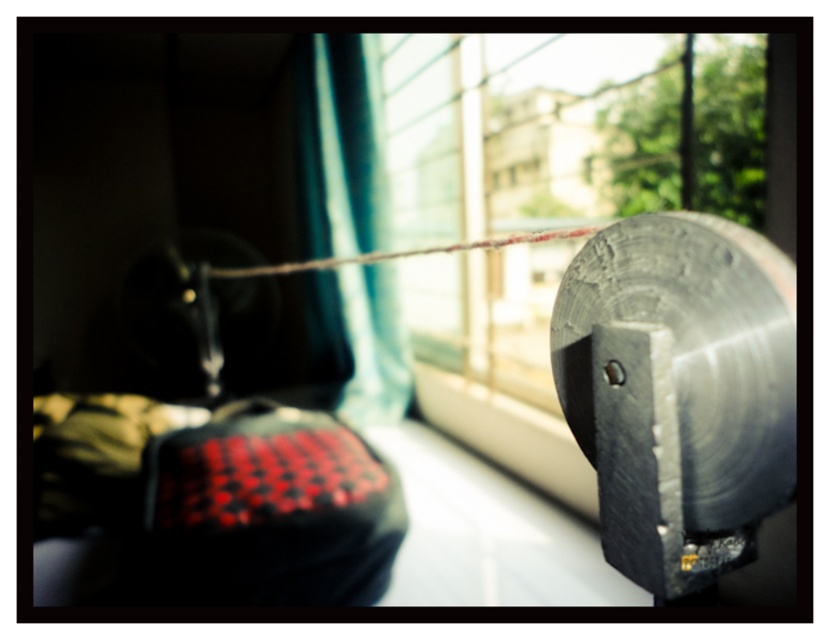
Question: Does metallic gray window at upper right have a smaller size compared to rusty wire at center?

Choices:
 (A) yes
 (B) no

Answer: (B)

Question: Which point is farther from the camera taking this photo?

Choices:
 (A) (374, 260)
 (B) (450, 340)

Answer: (B)

Question: Can you confirm if metallic gray window at upper right is positioned to the right of rusty wire at center?

Choices:
 (A) no
 (B) yes

Answer: (B)

Question: Which of these objects is positioned closest to the rusty wire at center?

Choices:
 (A) teal fabric curtain at center
 (B) metallic gray window at upper right

Answer: (A)

Question: Which of these objects is positioned farthest from the rusty wire at center?

Choices:
 (A) metallic gray window at upper right
 (B) teal fabric curtain at center

Answer: (A)

Question: Can you confirm if metallic gray window at upper right is wider than rusty wire at center?

Choices:
 (A) no
 (B) yes

Answer: (B)